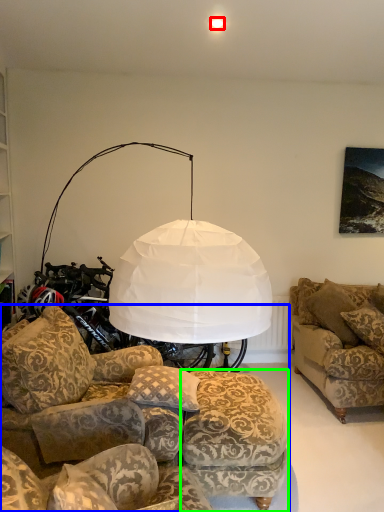
Question: Which object is positioned farthest from lighting (highlighted by a red box)? Select from studio couch (highlighted by a blue box) and footrest (highlighted by a green box).

Choices:
 (A) studio couch
 (B) footrest

Answer: (B)